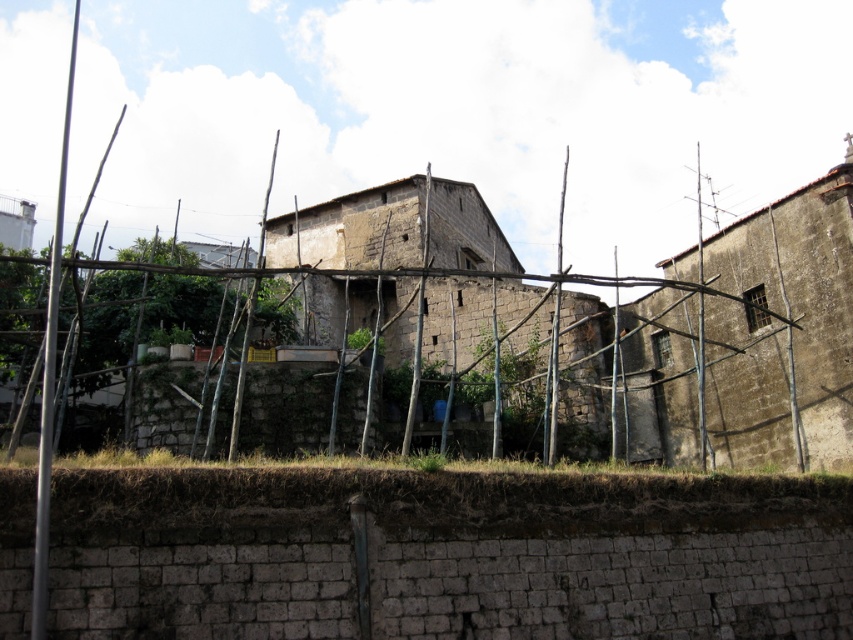
Who is positioned more to the left, brown dirt at lower center or rustic stone hut at right?

brown dirt at lower center

Is brown dirt at lower center behind rustic stone hut at right?

No, it is not.

Is point (22, 538) in front of point (666, 349)?

That is True.

I want to click on brown dirt at lower center, so click(x=445, y=554).

Is rustic stone hut at right below weathered stone hut at center?

Yes.

Does rustic stone hut at right appear on the left side of weathered stone hut at center?

No, rustic stone hut at right is not to the left of weathered stone hut at center.

The width and height of the screenshot is (853, 640). Describe the element at coordinates (753, 340) in the screenshot. I see `rustic stone hut at right` at that location.

At what (x,y) coordinates should I click in order to perform the action: click on rustic stone hut at right. Please return your answer as a coordinate pair (x, y). Looking at the image, I should click on (753, 340).

Where is `brown dirt at lower center`? brown dirt at lower center is located at coordinates (445, 554).

Between brown dirt at lower center and weathered stone hut at center, which one is positioned lower?

brown dirt at lower center

The image size is (853, 640). Describe the element at coordinates (445, 554) in the screenshot. I see `brown dirt at lower center` at that location.

The height and width of the screenshot is (640, 853). I want to click on brown dirt at lower center, so click(445, 554).